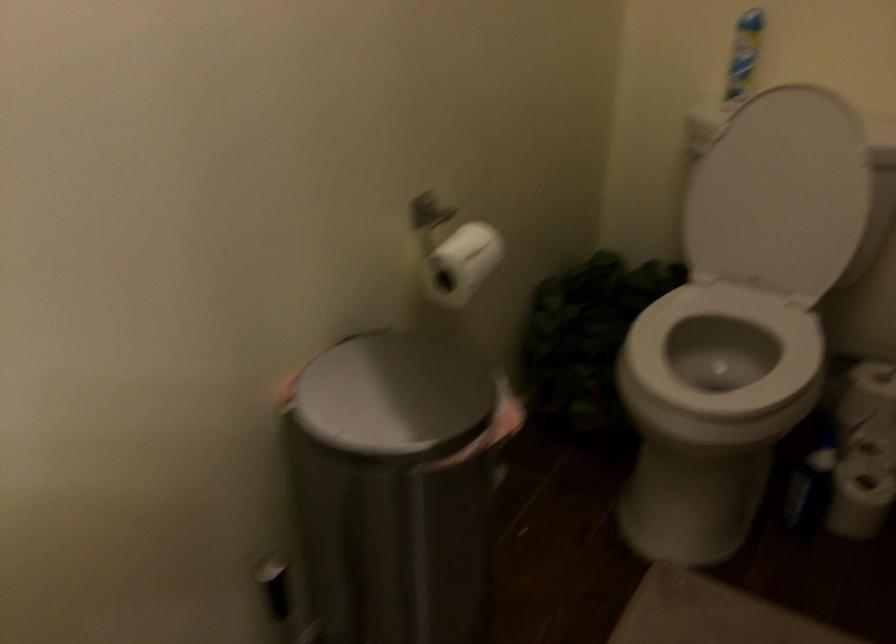
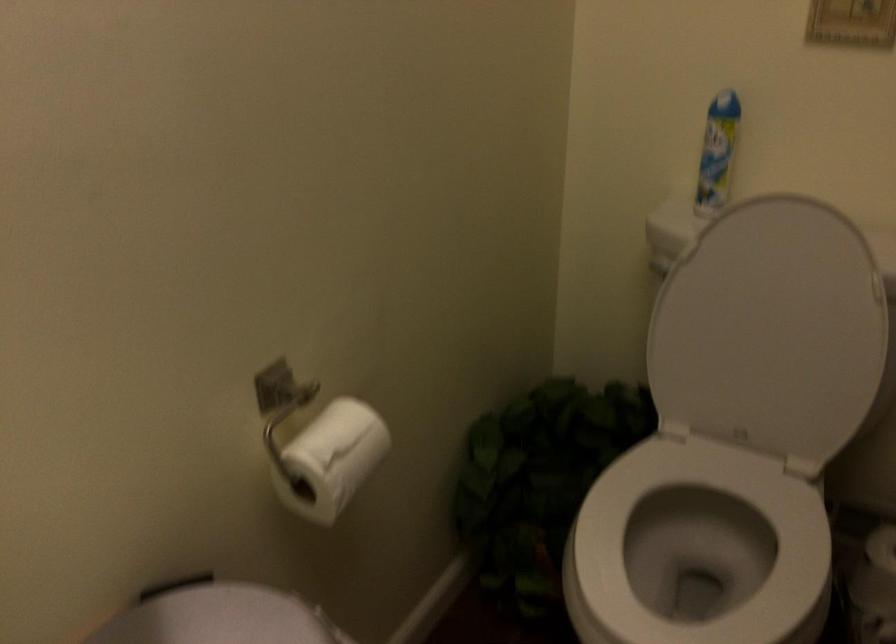
Find the pixel in the second image that matches point 463,259 in the first image.

(331, 459)